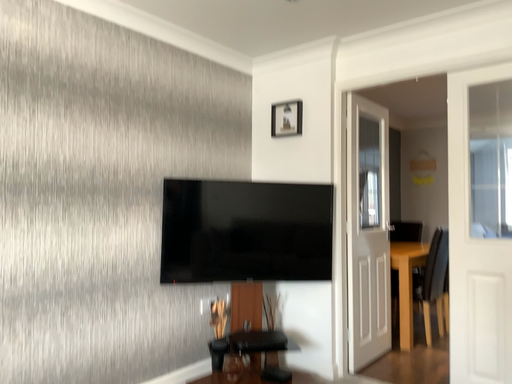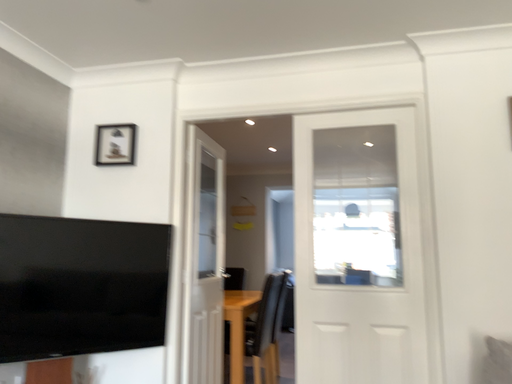
Question: Which way did the camera rotate in the video?

Choices:
 (A) rotated right
 (B) rotated left

Answer: (A)